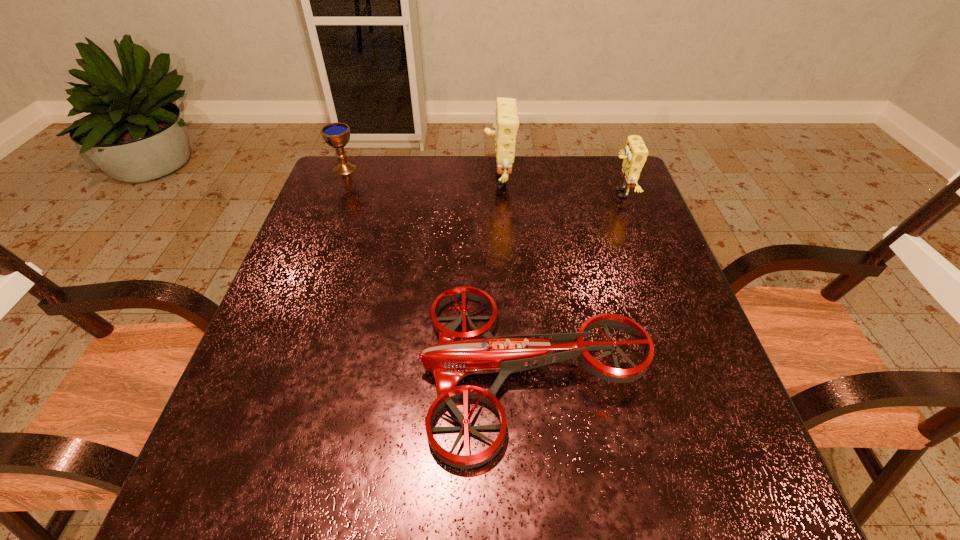
Where is `vacant region located on the face of the taller sponge`? vacant region located on the face of the taller sponge is located at coordinates (366, 178).

Identify the location of blank space located 0.060m on the face of the shorter sponge. The height and width of the screenshot is (540, 960). (588, 194).

You are a GUI agent. You are given a task and a screenshot of the screen. Output one action in this format:
    pyautogui.click(x=<x>, y=<y>)
    Task: Click on the vacant space located 0.200m on the face of the shorter sponge
    
    Given the screenshot: What is the action you would take?
    pos(540,194)

Identify the location of vacant space located 0.200m on the face of the shorter sponge. The width and height of the screenshot is (960, 540). (540, 194).

Image resolution: width=960 pixels, height=540 pixels. What are the coordinates of `vacant space located 0.230m on the right of the chalice` in the screenshot? It's located at (434, 168).

At what (x,y) coordinates should I click in order to perform the action: click on free space located on the back of the drone. Please return your answer as a coordinate pair (x, y). Image resolution: width=960 pixels, height=540 pixels. Looking at the image, I should click on (517, 213).

Find the location of a particular element. This screenshot has height=540, width=960. chalice positioned at the far edge is located at coordinates (337, 135).

Identify the location of object that is at the near edge. The width and height of the screenshot is (960, 540). (458, 354).

Image resolution: width=960 pixels, height=540 pixels. What are the coordinates of `object that is at the left edge` in the screenshot? It's located at (337, 135).

Identify the location of sponge at the right edge. (635, 154).